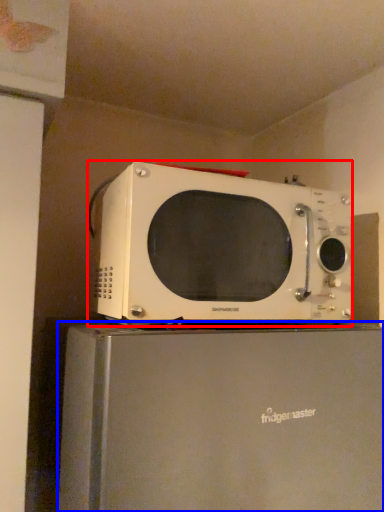
Question: Among these objects, which one is farthest to the camera, microwave oven (highlighted by a red box) or appliance (highlighted by a blue box)?

Choices:
 (A) microwave oven
 (B) appliance

Answer: (A)